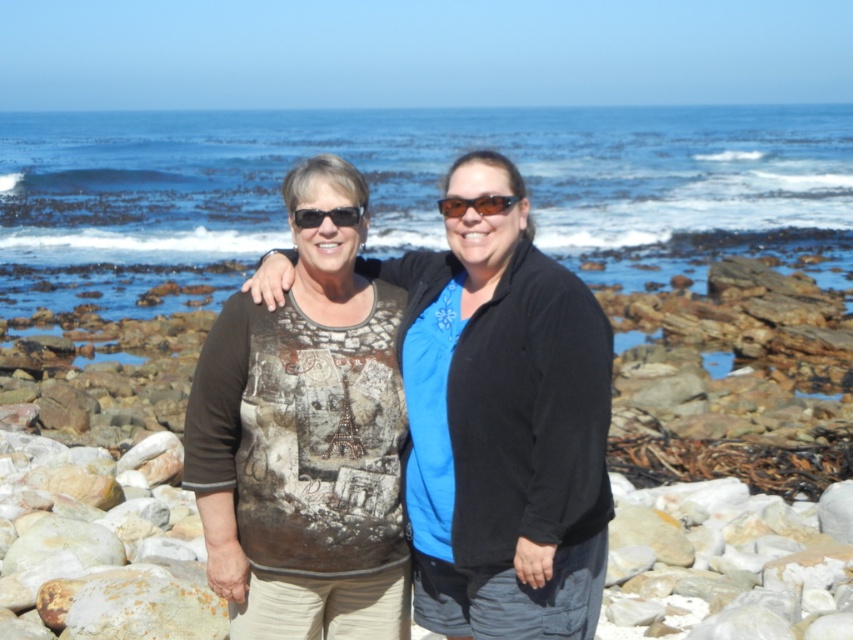
You are a photographer taking a picture of the blue water at center and the black plastic sunglasses at center. Which object appears larger in the photo?

The blue water at center appears larger in the photo because it is taller than the black plastic sunglasses at center.

What is the exact location of the printed cotton shirt at center in the image?

The printed cotton shirt at center is located at point coordinates of (502, 422).